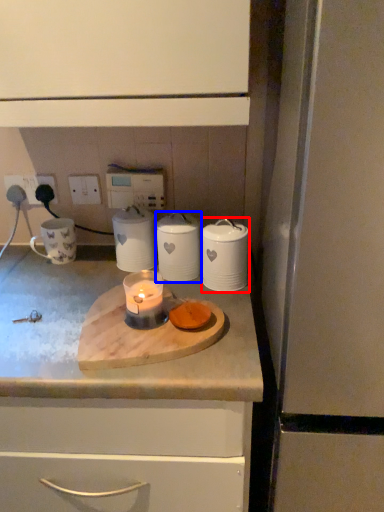
Question: Which object is closer to the camera taking this photo, kitchen appliance (highlighted by a red box) or kitchen appliance (highlighted by a blue box)?

Choices:
 (A) kitchen appliance
 (B) kitchen appliance

Answer: (A)